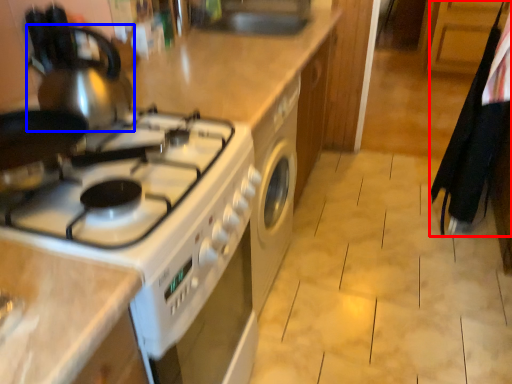
Question: Which point is closer to the camera, laundry (highlighted by a red box) or tea pot (highlighted by a blue box)?

Choices:
 (A) laundry
 (B) tea pot

Answer: (B)